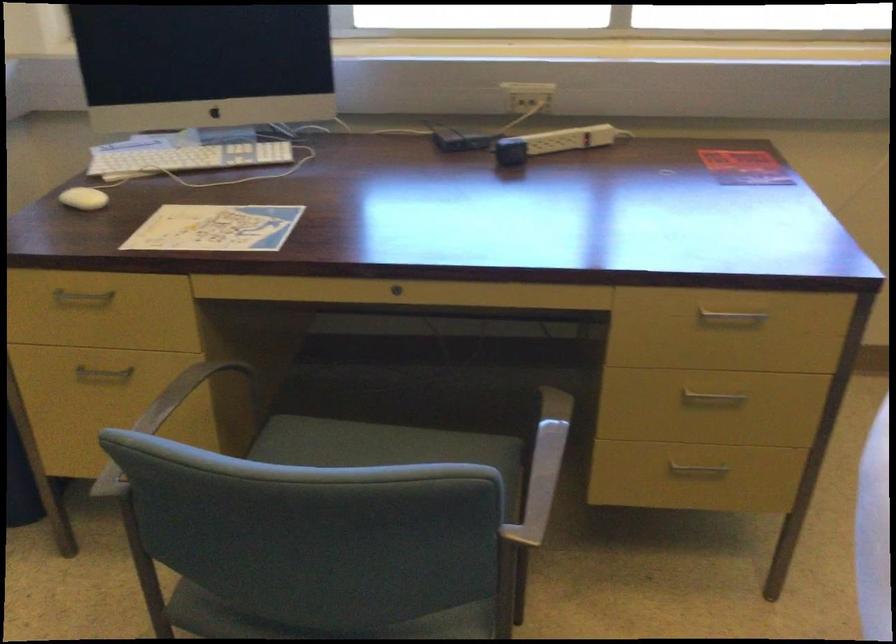
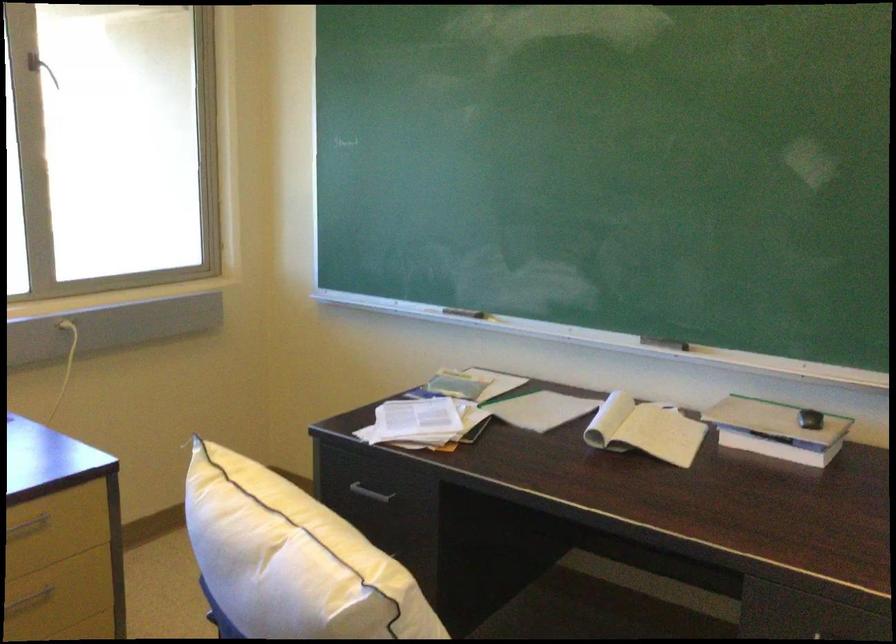
Question: The images are taken continuously from a first-person perspective. In which direction is your viewpoint rotating?

Choices:
 (A) Left
 (B) Right
 (C) Up
 (D) Down

Answer: (B)